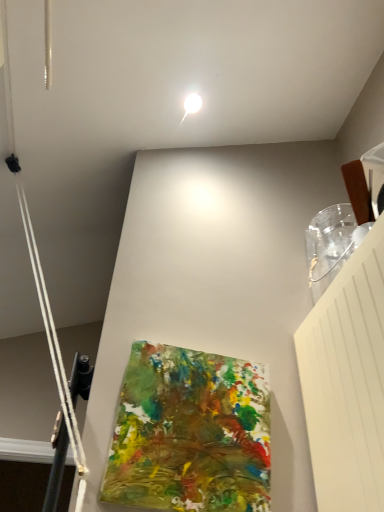
Question: From the image's perspective, is white glossy droplight at upper center positioned above or below abstract painting at center?

Choices:
 (A) above
 (B) below

Answer: (A)

Question: Is white glossy droplight at upper center taller or shorter than abstract painting at center?

Choices:
 (A) short
 (B) tall

Answer: (A)

Question: From a real-world perspective, is white glossy droplight at upper center physically located above or below abstract painting at center?

Choices:
 (A) below
 (B) above

Answer: (B)

Question: Is abstract painting at center inside the boundaries of white glossy droplight at upper center, or outside?

Choices:
 (A) outside
 (B) inside

Answer: (A)

Question: Is abstract painting at center bigger or smaller than white glossy droplight at upper center?

Choices:
 (A) big
 (B) small

Answer: (A)

Question: Is abstract painting at center to the left or to the right of white glossy droplight at upper center in the image?

Choices:
 (A) right
 (B) left

Answer: (A)

Question: In terms of width, does abstract painting at center look wider or thinner when compared to white glossy droplight at upper center?

Choices:
 (A) thin
 (B) wide

Answer: (A)